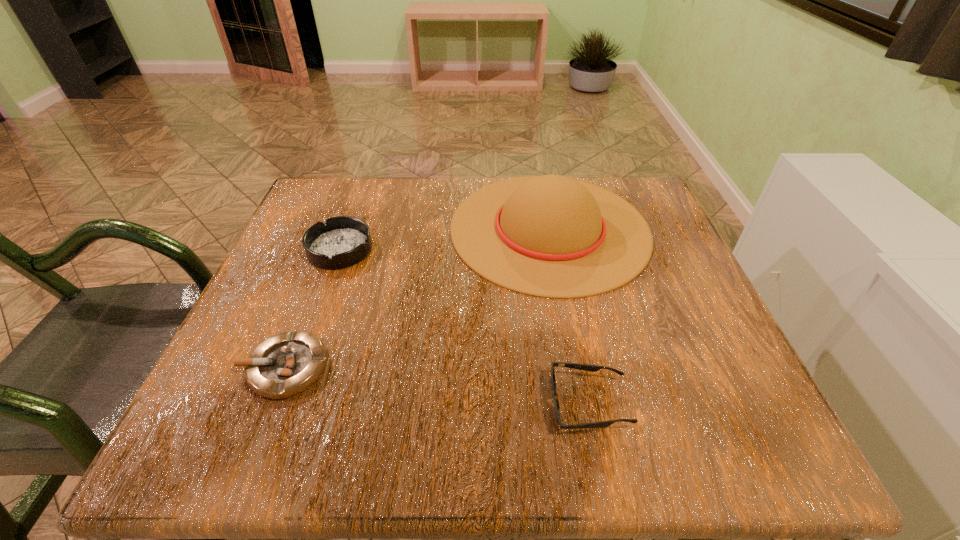
I want to click on free space between the farther ashtray and the sombrero, so click(444, 239).

At what (x,y) coordinates should I click in order to perform the action: click on unoccupied area between the sunglasses and the farther ashtray. Please return your answer as a coordinate pair (x, y). This screenshot has height=540, width=960. Looking at the image, I should click on (465, 327).

Locate an element on the screen. empty space between the farther ashtray and the sunglasses is located at coordinates (465, 327).

In order to click on object that is the second nearest to the sunglasses in this screenshot , I will do `click(287, 364)`.

Locate an element on the screen. Image resolution: width=960 pixels, height=540 pixels. the third closest object to the sunglasses is located at coordinates (343, 241).

Locate an element on the screen. This screenshot has width=960, height=540. vacant space that satisfies the following two spatial constraints: 1. on the back side of the farther ashtray; 2. on the right side of the tallest object is located at coordinates coord(348,228).

Find the location of `vacant area in the image that satisfies the following two spatial constraints: 1. on the back side of the farther ashtray; 2. on the right side of the tallest object`. vacant area in the image that satisfies the following two spatial constraints: 1. on the back side of the farther ashtray; 2. on the right side of the tallest object is located at coordinates (348, 228).